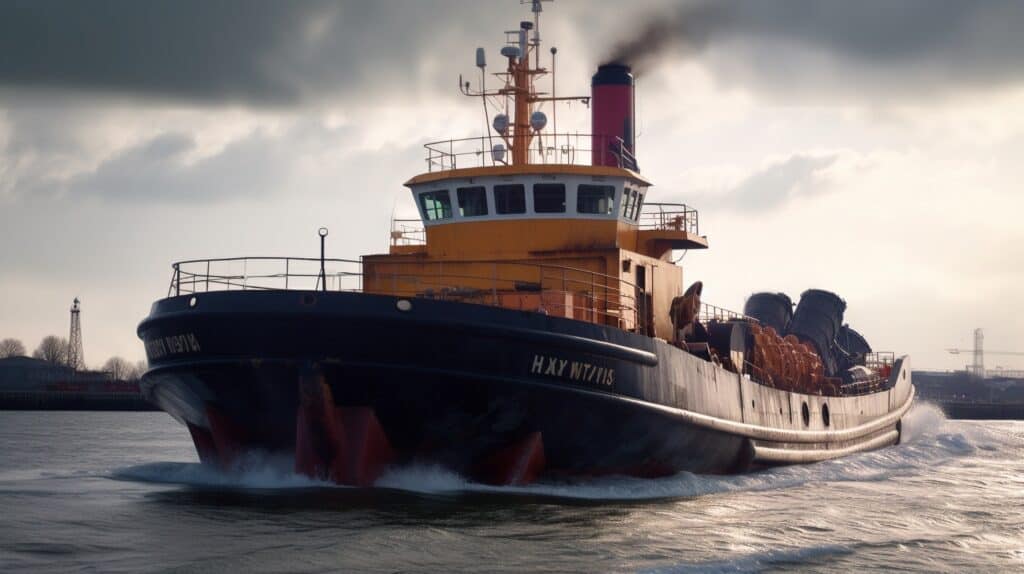
Where is `speakers`? The width and height of the screenshot is (1024, 574). speakers is located at coordinates (535, 116), (497, 124), (495, 154).